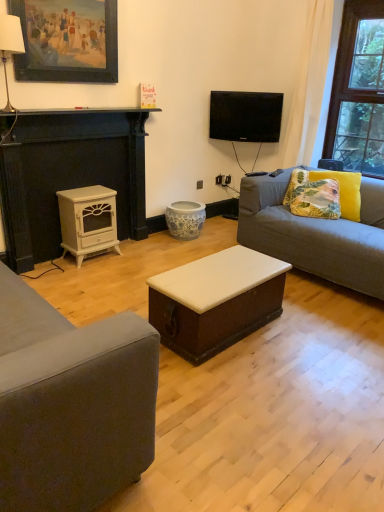
Find the location of a particular element. empty space that is to the right of white painted wood trunk at center, marked as the first table in a front-to-back arrangement is located at coordinates (318, 342).